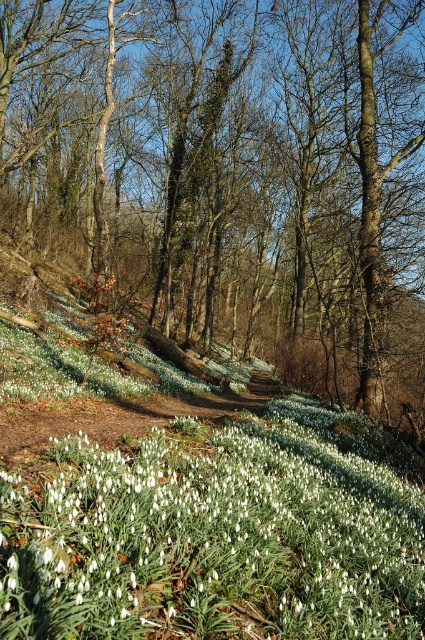
Question: Can you confirm if brown bark tree at center is bigger than white matte snowdrop at center?

Choices:
 (A) no
 (B) yes

Answer: (B)

Question: Which point appears farthest from the camera in this image?

Choices:
 (A) [261, 237]
 (B) [387, 563]

Answer: (A)

Question: Does brown bark tree at center have a smaller size compared to white matte snowdrop at center?

Choices:
 (A) no
 (B) yes

Answer: (A)

Question: Among these points, which one is nearest to the camera?

Choices:
 (A) (76, 154)
 (B) (198, 474)

Answer: (B)

Question: Is brown bark tree at center thinner than white matte snowdrop at center?

Choices:
 (A) yes
 (B) no

Answer: (B)